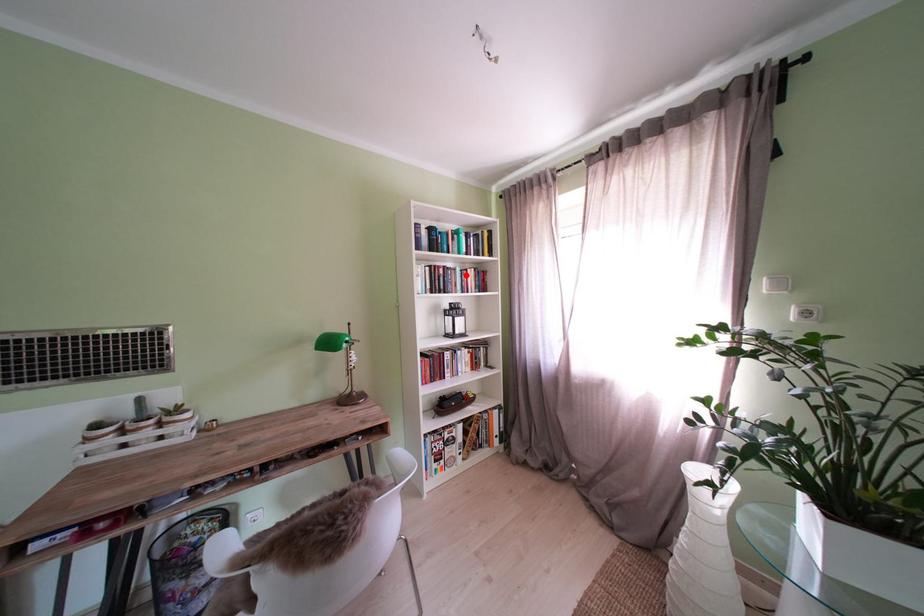
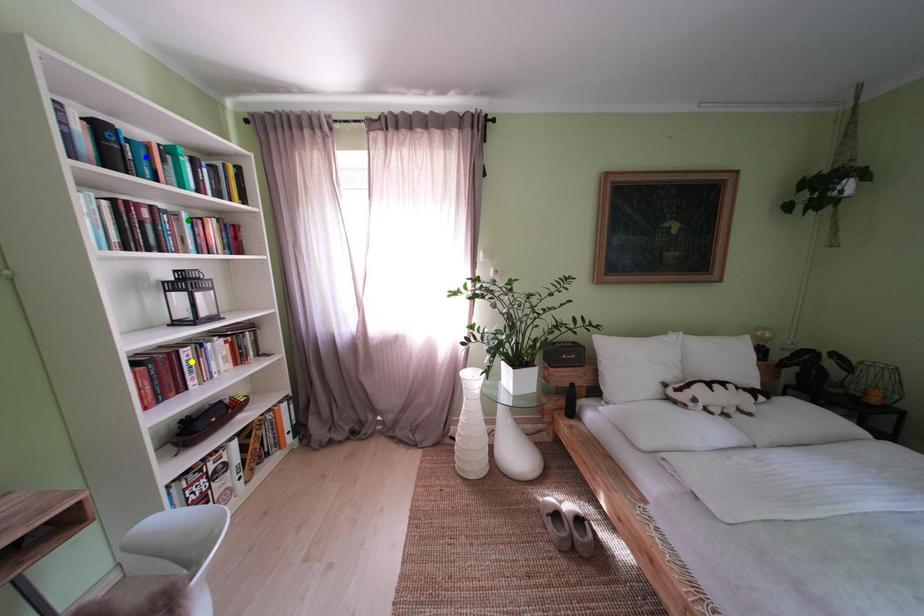
Question: I am providing you with two images of the same scene from different viewpoints. A red point is marked on the first image. You are given multiple points on the second image. Which point in image 2 is actually the same real-world point as the red point in image 1?

Choices:
 (A) blue point
 (B) yellow point
 (C) green point

Answer: (C)